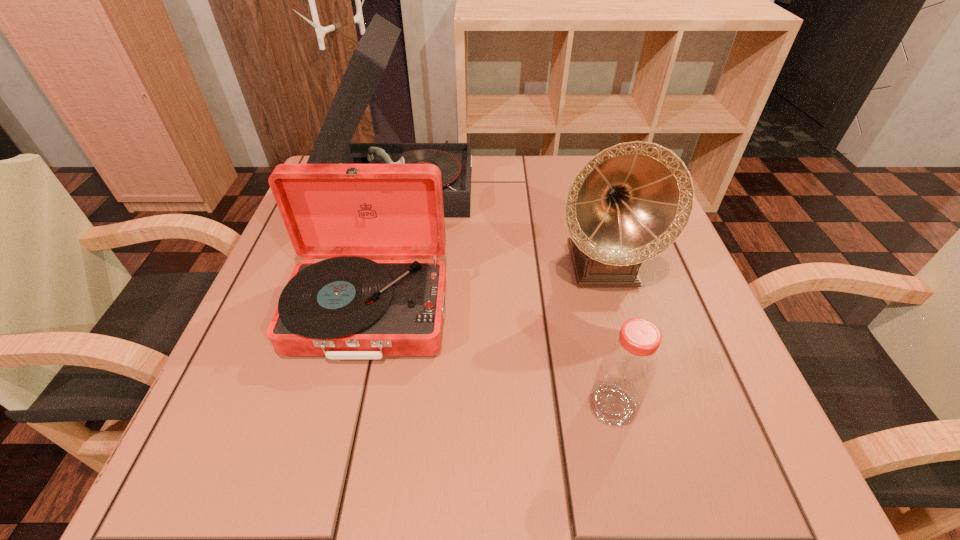
Identify the location of vacant region that satisfies the following two spatial constraints: 1. on the front-facing side of the farthest phonograph_record; 2. on the left side of the nearest object. The width and height of the screenshot is (960, 540). (348, 406).

Locate an element on the screen. vacant space that satisfies the following two spatial constraints: 1. on the front-facing side of the tallest phonograph_record; 2. on the front-facing side of the shortest phonograph_record is located at coordinates click(370, 312).

This screenshot has height=540, width=960. I want to click on vacant space that satisfies the following two spatial constraints: 1. on the front-facing side of the tallest phonograph_record; 2. on the left side of the bottle, so click(348, 406).

This screenshot has width=960, height=540. What are the coordinates of `vacant space that satisfies the following two spatial constraints: 1. on the back side of the nearest object; 2. on the front-facing side of the tallest object` in the screenshot? It's located at (561, 184).

Locate an element on the screen. vacant area that satisfies the following two spatial constraints: 1. on the front-facing side of the farthest object; 2. on the front-facing side of the shortest phonograph_record is located at coordinates (370, 312).

Locate an element on the screen. This screenshot has height=540, width=960. vacant space that satisfies the following two spatial constraints: 1. on the front-facing side of the second shortest object; 2. on the right side of the nearest object is located at coordinates (348, 406).

This screenshot has height=540, width=960. Find the location of `vacant point that satisfies the following two spatial constraints: 1. on the front-facing side of the shortest object; 2. on the right side of the farthest object`. vacant point that satisfies the following two spatial constraints: 1. on the front-facing side of the shortest object; 2. on the right side of the farthest object is located at coordinates (348, 406).

At what (x,y) coordinates should I click in order to perform the action: click on vacant space that satisfies the following two spatial constraints: 1. on the front-facing side of the tallest phonograph_record; 2. on the right side of the bottle. Please return your answer as a coordinate pair (x, y). This screenshot has width=960, height=540. Looking at the image, I should click on coord(348,406).